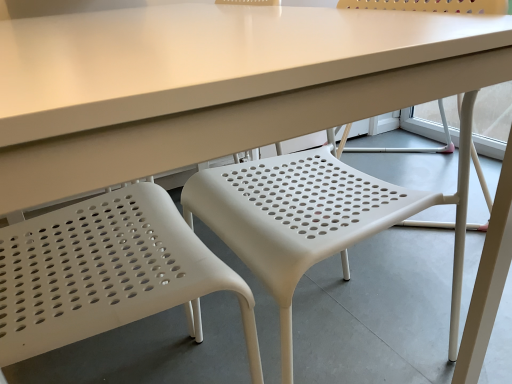
Question: From the image's perspective, is white plastic chair at center, which appears as the second chair when viewed from the left, under white plastic chair at left, which is the 2th chair in right-to-left order?

Choices:
 (A) yes
 (B) no

Answer: (B)

Question: Is white plastic chair at center, which appears as the second chair when viewed from the left, not near white plastic chair at left, which is the 1th chair from left to right?

Choices:
 (A) yes
 (B) no

Answer: (B)

Question: Is white plastic chair at center, which is the first chair in right-to-left order, turned away from white plastic chair at left, which is the 2th chair in right-to-left order?

Choices:
 (A) no
 (B) yes

Answer: (B)

Question: From a real-world perspective, is white plastic chair at center, which appears as the second chair when viewed from the left, under white plastic chair at left, which is the 2th chair in right-to-left order?

Choices:
 (A) no
 (B) yes

Answer: (A)

Question: Does white plastic chair at center, which is the first chair in right-to-left order, come behind white plastic chair at left, which is the 1th chair from left to right?

Choices:
 (A) no
 (B) yes

Answer: (B)

Question: Would you say white plastic chair at center, which appears as the second chair when viewed from the left, is outside white plastic chair at left, which is the 1th chair from left to right?

Choices:
 (A) yes
 (B) no

Answer: (A)

Question: From the image's perspective, does white plastic chair at left, which is the 2th chair in right-to-left order, appear lower than white plastic chair at center, which appears as the second chair when viewed from the left?

Choices:
 (A) yes
 (B) no

Answer: (A)

Question: Is white plastic chair at left, which is the 1th chair from left to right, smaller than white plastic chair at center, which appears as the second chair when viewed from the left?

Choices:
 (A) yes
 (B) no

Answer: (A)

Question: From a real-world perspective, is white plastic chair at left, which is the 1th chair from left to right, on white plastic chair at center, which is the first chair in right-to-left order?

Choices:
 (A) yes
 (B) no

Answer: (B)

Question: Is white plastic chair at left, which is the 2th chair in right-to-left order, completely or partially outside of white plastic chair at center, which is the first chair in right-to-left order?

Choices:
 (A) yes
 (B) no

Answer: (A)

Question: Can you confirm if white plastic chair at left, which is the 2th chair in right-to-left order, is shorter than white plastic chair at center, which is the first chair in right-to-left order?

Choices:
 (A) no
 (B) yes

Answer: (A)

Question: Is white plastic chair at left, which is the 2th chair in right-to-left order, positioned in front of white plastic chair at center, which is the first chair in right-to-left order?

Choices:
 (A) yes
 (B) no

Answer: (A)

Question: From a real-world perspective, is white plastic chair at left, which is the 1th chair from left to right, positioned above or below white plastic chair at center, which is the first chair in right-to-left order?

Choices:
 (A) above
 (B) below

Answer: (B)